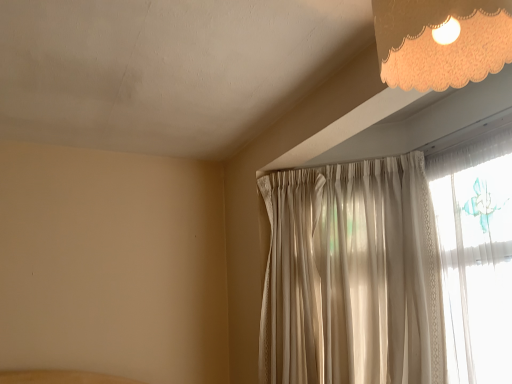
Question: Does point (435, 21) appear closer or farther from the camera than point (408, 324)?

Choices:
 (A) farther
 (B) closer

Answer: (B)

Question: From a real-world perspective, is ivory lace lampshade at upper right above or below silky white curtain at upper right?

Choices:
 (A) above
 (B) below

Answer: (A)

Question: Which is correct: ivory lace lampshade at upper right is inside silky white curtain at upper right, or outside of it?

Choices:
 (A) inside
 (B) outside

Answer: (B)

Question: Is silky white curtain at upper right to the left or to the right of ivory lace lampshade at upper right in the image?

Choices:
 (A) left
 (B) right

Answer: (A)

Question: Considering their positions, is silky white curtain at upper right located in front of or behind ivory lace lampshade at upper right?

Choices:
 (A) front
 (B) behind

Answer: (B)

Question: From a real-world perspective, is silky white curtain at upper right physically located above or below ivory lace lampshade at upper right?

Choices:
 (A) above
 (B) below

Answer: (B)

Question: Is silky white curtain at upper right spatially inside ivory lace lampshade at upper right, or outside of it?

Choices:
 (A) outside
 (B) inside

Answer: (A)